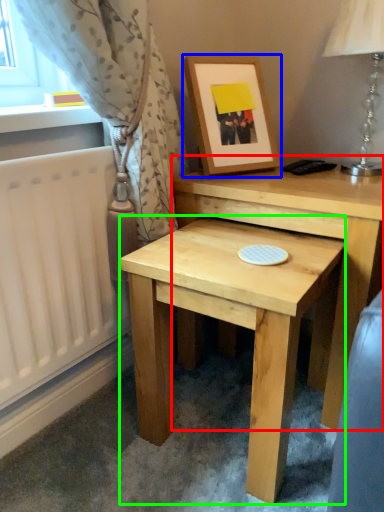
Question: Considering the real-world distances, which object is closest to table (highlighted by a red box)? picture frame (highlighted by a blue box) or table (highlighted by a green box).

Choices:
 (A) picture frame
 (B) table

Answer: (B)